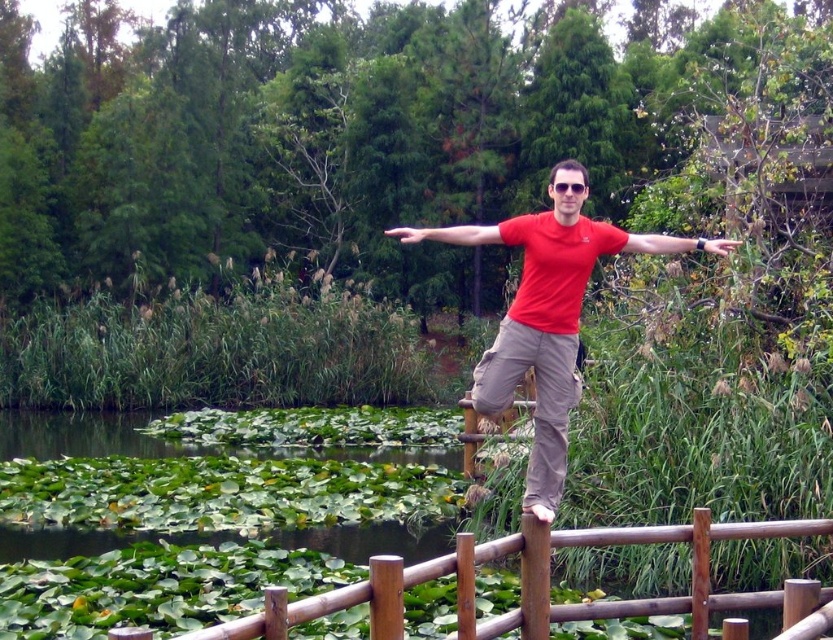
You are a safety inspector evaluating the scene. The safety guidelines state that there must be at least 6 meters of clearance between any railing and a person standing on it to prevent overcrowding. Based on the image, is the distance between the brown wooden rail at center and the red matte shirt at center compliant with the safety guidelines?

The distance between the brown wooden rail at center and the red matte shirt at center is 5.35 meters, which is less than the required 6 meters. Therefore, the scene does not comply with the safety guidelines.